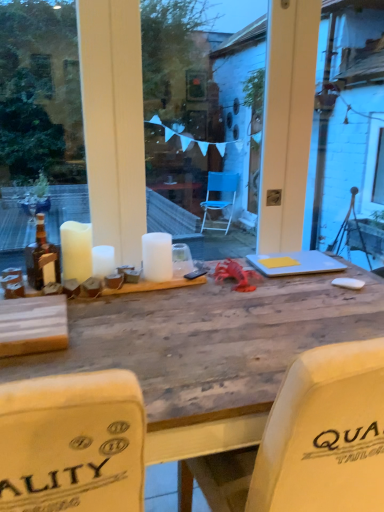
Find the location of `wooden table at center`. wooden table at center is located at coordinates (210, 351).

What do you see at coordinates (76, 250) in the screenshot?
I see `white matte candle at left, acting as the third candle starting from the right` at bounding box center [76, 250].

Where is `matte brown bottle at left`? matte brown bottle at left is located at coordinates (43, 257).

The height and width of the screenshot is (512, 384). I want to click on white matte candle at center, the 1th candle in the right-to-left sequence, so click(157, 256).

Is yellow paper at center facing towards transparent glass window at center?

No, yellow paper at center is not facing towards transparent glass window at center.

Is yellow paper at center outside of transparent glass window at center?

Absolutely, yellow paper at center is external to transparent glass window at center.

Is the depth of yellow paper at center less than that of transparent glass window at center?

No.

In terms of height, does wooden table at center look taller or shorter compared to white matte candle at center, which is counted as the second candle, starting from the left?

In the image, wooden table at center appears to be taller than white matte candle at center, which is counted as the second candle, starting from the left.

Is wooden table at center to the right of white matte candle at center, which is counted as the second candle, starting from the left, from the viewer's perspective?

Correct, you'll find wooden table at center to the right of white matte candle at center, which is counted as the second candle, starting from the left.

From the picture: Are wooden table at center and white matte candle at center, marked as the 2th candle in a right-to-left arrangement, located far from each other?

No, wooden table at center is not far away from white matte candle at center, marked as the 2th candle in a right-to-left arrangement.

From the picture: From a real-world perspective, does wooden table at center sit lower than white matte candle at center, which is counted as the second candle, starting from the left?

Yes, from a real-world perspective, wooden table at center is below white matte candle at center, which is counted as the second candle, starting from the left.

Does white matte candle at center, the 1th candle in the right-to-left sequence, appear on the left side of yellow paper at center?

Yes, white matte candle at center, the 1th candle in the right-to-left sequence, is to the left of yellow paper at center.

Looking at this image, is white matte candle at center, the 1th candle in the right-to-left sequence, positioned far away from yellow paper at center?

No, white matte candle at center, the 1th candle in the right-to-left sequence, is not far away from yellow paper at center.

Find the location of a particular element. notepad below the white matte candle at center, the 1th candle in the right-to-left sequence (from the image's perspective) is located at coordinates (278, 262).

Is white matte candle at center, the 1th candle in the right-to-left sequence, oriented towards yellow paper at center?

No.

In the scene shown: From the image's perspective, between matte brown bottle at left and wooden table at center, who is located below?

wooden table at center.

Identify the location of table on the right of the matte brown bottle at left. (210, 351).

Can you tell me how much matte brown bottle at left and wooden table at center differ in facing direction?

The facing directions of matte brown bottle at left and wooden table at center are 180 degrees apart.

Looking at this image, considering the sizes of objects matte brown bottle at left and wooden table at center in the image provided, who is wider, matte brown bottle at left or wooden table at center?

With larger width is wooden table at center.

Is white matte candle at center, the 1th candle in the right-to-left sequence, completely or partially inside yellow paper at center?

That's incorrect, white matte candle at center, the 1th candle in the right-to-left sequence, is not inside yellow paper at center.

Considering the positions of point (287, 263) and point (165, 254), is point (287, 263) closer or farther from the camera than point (165, 254)?

Point (287, 263) is farther from the camera than point (165, 254).

How many degrees apart are the facing directions of yellow paper at center and white matte candle at center, which appears as the 3th candle when viewed from the left?

2.44 degrees separate the facing orientations of yellow paper at center and white matte candle at center, which appears as the 3th candle when viewed from the left.

Looking at the image, does yellow paper at center seem bigger or smaller compared to white matte candle at center, which appears as the 3th candle when viewed from the left?

Considering their sizes, yellow paper at center takes up less space than white matte candle at center, which appears as the 3th candle when viewed from the left.

From a real-world perspective, is white matte candle at center, which is counted as the second candle, starting from the left, positioned above or below matte brown bottle at left?

white matte candle at center, which is counted as the second candle, starting from the left, is situated lower than matte brown bottle at left in the real world.

Is white matte candle at center, marked as the 2th candle in a right-to-left arrangement, bigger or smaller than matte brown bottle at left?

white matte candle at center, marked as the 2th candle in a right-to-left arrangement, is smaller than matte brown bottle at left.

Considering the relative positions of white matte candle at center, marked as the 2th candle in a right-to-left arrangement, and matte brown bottle at left in the image provided, is white matte candle at center, marked as the 2th candle in a right-to-left arrangement, to the right of matte brown bottle at left from the viewer's perspective?

Indeed, white matte candle at center, marked as the 2th candle in a right-to-left arrangement, is positioned on the right side of matte brown bottle at left.

Is white matte candle at center, which is counted as the second candle, starting from the left, positioned behind matte brown bottle at left?

Yes, the depth of white matte candle at center, which is counted as the second candle, starting from the left, is greater than that of matte brown bottle at left.

Considering the sizes of objects wooden table at center and yellow paper at center in the image provided, who is taller, wooden table at center or yellow paper at center?

Standing taller between the two is wooden table at center.

Is the depth of wooden table at center less than that of yellow paper at center?

Yes, wooden table at center is in front of yellow paper at center.

Between wooden table at center and yellow paper at center, which one has larger width?

With larger width is wooden table at center.

Is wooden table at center at the left side of yellow paper at center?

Yes, wooden table at center is to the left of yellow paper at center.

This screenshot has height=512, width=384. Identify the location of glass window in front of the yellow paper at center. (202, 125).

The height and width of the screenshot is (512, 384). In order to click on the 2nd candle to the left of the wooden table at center, starting your count from the anchor in this screenshot , I will do `click(103, 260)`.

Looking at the image, which one is located further to white matte candle at center, the 1th candle in the right-to-left sequence, yellow paper at center or matte brown bottle at left?

yellow paper at center.

From the image, which object appears to be farther from transparent glass window at center, matte brown bottle at left or white matte candle at center, which is counted as the second candle, starting from the left?

The object further to transparent glass window at center is white matte candle at center, which is counted as the second candle, starting from the left.

When comparing their distances from wooden table at center, does white matte candle at center, the 1th candle in the right-to-left sequence, or white matte candle at left, acting as the third candle starting from the right, seem further?

Among the two, white matte candle at left, acting as the third candle starting from the right, is located further to wooden table at center.

From the image, which object appears to be nearer to matte brown bottle at left, white matte candle at center, which is counted as the second candle, starting from the left, or wooden table at center?

The object closer to matte brown bottle at left is white matte candle at center, which is counted as the second candle, starting from the left.

Which object lies further to the anchor point matte brown bottle at left, yellow paper at center or white matte candle at center, which appears as the 3th candle when viewed from the left?

yellow paper at center is positioned further to the anchor matte brown bottle at left.

From the image, which object appears to be farther from yellow paper at center, wooden table at center or white matte candle at left, which appears as the first candle when viewed from the left?

white matte candle at left, which appears as the first candle when viewed from the left, is positioned further to the anchor yellow paper at center.

Looking at the image, which one is located further to transparent glass window at center, yellow paper at center or white matte candle at left, acting as the third candle starting from the right?

white matte candle at left, acting as the third candle starting from the right, is further to transparent glass window at center.

Based on their spatial positions, is wooden table at center or matte brown bottle at left further from white matte candle at center, which appears as the 3th candle when viewed from the left?

wooden table at center.

Where is `bottle between wooden table at center and yellow paper at center in the front-back direction`? The image size is (384, 512). bottle between wooden table at center and yellow paper at center in the front-back direction is located at coordinates (43, 257).

This screenshot has width=384, height=512. I want to click on glass window between white matte candle at center, marked as the 2th candle in a right-to-left arrangement, and yellow paper at center, so click(x=202, y=125).

Where is `candle located between matte brown bottle at left and white matte candle at center, marked as the 2th candle in a right-to-left arrangement, in the left-right direction`? This screenshot has height=512, width=384. candle located between matte brown bottle at left and white matte candle at center, marked as the 2th candle in a right-to-left arrangement, in the left-right direction is located at coordinates (76, 250).

You are a GUI agent. You are given a task and a screenshot of the screen. Output one action in this format:
    pyautogui.click(x=<x>, y=<y>)
    Task: Click on the candle between white matte candle at center, marked as the 2th candle in a right-to-left arrangement, and yellow paper at center from left to right
    Image resolution: width=384 pixels, height=512 pixels.
    Given the screenshot: What is the action you would take?
    pyautogui.click(x=157, y=256)